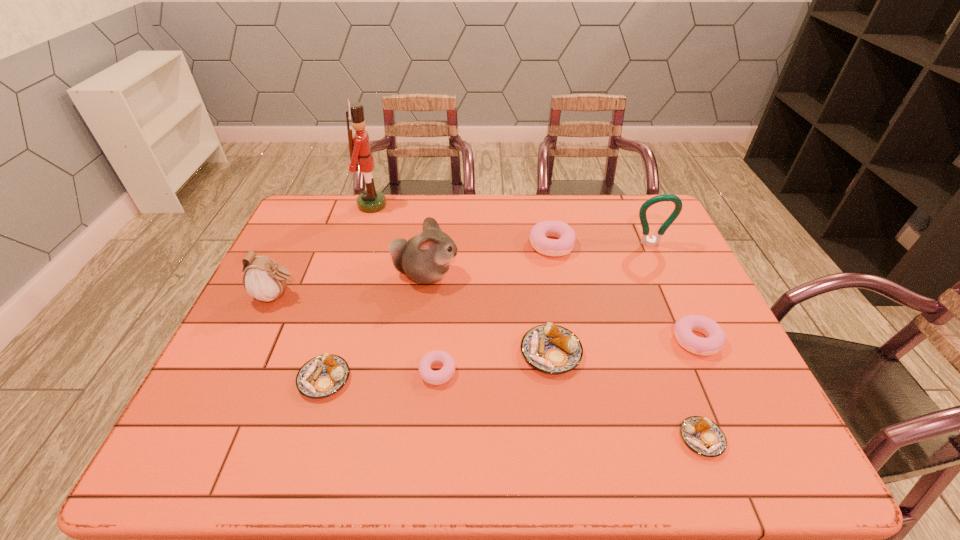
Where is `vacant position in the image that satisfies the following two spatial constraints: 1. on the front-facing side of the farthest object; 2. on the back side of the second biggest pink pastry`? The width and height of the screenshot is (960, 540). vacant position in the image that satisfies the following two spatial constraints: 1. on the front-facing side of the farthest object; 2. on the back side of the second biggest pink pastry is located at coordinates (329, 340).

Where is `free space that satisfies the following two spatial constraints: 1. at the jaws of the second biggest pink pastry; 2. on the left side of the bottle opener`? free space that satisfies the following two spatial constraints: 1. at the jaws of the second biggest pink pastry; 2. on the left side of the bottle opener is located at coordinates (694, 340).

Find the location of a particular element. Image resolution: width=960 pixels, height=540 pixels. free space that satisfies the following two spatial constraints: 1. on the front-facing side of the leftmost brown pastry; 2. on the left side of the tallest object is located at coordinates (317, 379).

Find the location of `free location that satisfies the following two spatial constraints: 1. on the front-facing side of the farthest object; 2. on the back side of the leftmost pink pastry`. free location that satisfies the following two spatial constraints: 1. on the front-facing side of the farthest object; 2. on the back side of the leftmost pink pastry is located at coordinates (320, 372).